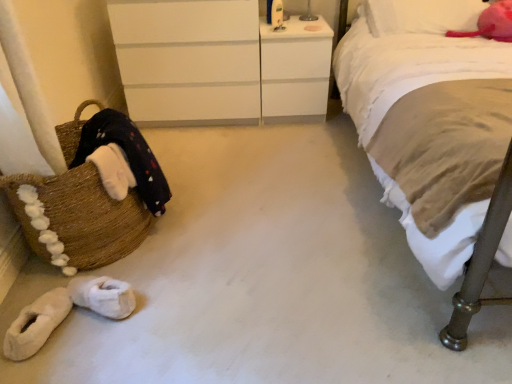
What do you see at coordinates (436, 136) in the screenshot?
I see `beige cotton bed at right` at bounding box center [436, 136].

This screenshot has width=512, height=384. Identify the location of white fluffy slippers at lower left, placed as the 2th footwear when sorted from left to right. (103, 296).

Which point is more forward, (x=462, y=204) or (x=146, y=39)?

Point (x=462, y=204)

Is beige cotton bed at right positioned with its back to white matte chest of drawers at upper center?

That's not correct — beige cotton bed at right is not looking away from white matte chest of drawers at upper center.

Can you tell me how much beige cotton bed at right and white matte chest of drawers at upper center differ in facing direction?

The angle between the facing direction of beige cotton bed at right and the facing direction of white matte chest of drawers at upper center is 1.53 degrees.

From the image's perspective, is beige cotton bed at right on top of white matte chest of drawers at upper center?

No, from the image's perspective, beige cotton bed at right is not on top of white matte chest of drawers at upper center.

Is velvety pink pillow at upper right directly adjacent to white matte chest of drawers at upper center?

velvety pink pillow at upper right and white matte chest of drawers at upper center are clearly separated.

Which of these two, velvety pink pillow at upper right or white matte chest of drawers at upper center, stands taller?

white matte chest of drawers at upper center.

How different are the orientations of velvety pink pillow at upper right and white matte chest of drawers at upper center in degrees?

There is a 2.8-degree angle between the facing directions of velvety pink pillow at upper right and white matte chest of drawers at upper center.

Between white glossy vanity at upper center and velvety pink pillow at upper right, which one is positioned in front?

velvety pink pillow at upper right is more forward.

From a real-world perspective, is white glossy vanity at upper center below velvety pink pillow at upper right?

Yes, from a real-world perspective, white glossy vanity at upper center is beneath velvety pink pillow at upper right.

Is white glossy vanity at upper center bigger than velvety pink pillow at upper right?

Yes.

This screenshot has width=512, height=384. I want to click on pillow in front of the white glossy vanity at upper center, so (x=421, y=16).

Which object is wider, velvety pink pillow at upper right or beige cotton bed at right?

beige cotton bed at right.

Considering the relative sizes of velvety pink pillow at upper right and beige cotton bed at right in the image provided, is velvety pink pillow at upper right bigger than beige cotton bed at right?

Actually, velvety pink pillow at upper right might be smaller than beige cotton bed at right.

From the image's perspective, is velvety pink pillow at upper right located above or below beige cotton bed at right?

From the image's perspective, velvety pink pillow at upper right appears above beige cotton bed at right.

From a real-world perspective, which object rests below the other?

beige cotton bed at right.

From a real-world perspective, which object rests below the other?

white matte chest of drawers at upper center, from a real-world perspective.

Consider the image. Does white matte chest of drawers at upper center turn towards beige cotton bed at right?

No, white matte chest of drawers at upper center is not aimed at beige cotton bed at right.

Is white matte chest of drawers at upper center not within beige cotton bed at right?

Yes.

Which object is positioned more to the right, white matte chest of drawers at upper center or beige cotton bed at right?

beige cotton bed at right is more to the right.

Considering the points (381, 88) and (302, 43), which point is in front, point (381, 88) or point (302, 43)?

The point (381, 88) is closer.

Is beige cotton bed at right positioned far away from white glossy vanity at upper center?

They are positioned close to each other.

Which object is further away from the camera taking this photo, beige cotton bed at right or white glossy vanity at upper center?

white glossy vanity at upper center is further from the camera.

From a real-world perspective, between beige cotton bed at right and white glossy vanity at upper center, who is vertically higher?

In real-world perspective, beige cotton bed at right is above.

Does velvety pink pillow at upper right have a greater height compared to brown woven basket at left?

In fact, velvety pink pillow at upper right may be shorter than brown woven basket at left.

In terms of width, does velvety pink pillow at upper right look wider or thinner when compared to brown woven basket at left?

Considering their sizes, velvety pink pillow at upper right looks broader than brown woven basket at left.

Is velvety pink pillow at upper right far from brown woven basket at left?

Yes, velvety pink pillow at upper right and brown woven basket at left are located far from each other.

Between point (365, 6) and point (64, 232), which one is positioned in front?

The point (64, 232) is closer to the camera.

Locate an element on the screen. This screenshot has height=384, width=512. bed located in front of the white matte chest of drawers at upper center is located at coordinates (436, 136).

I want to click on pillow that is above the white matte chest of drawers at upper center (from a real-world perspective), so click(421, 16).

Estimate the real-world distances between objects in this image. Which object is closer to white fluffy slippers at lower left, placed as the 2th footwear when sorted from left to right, brown woven basket at left or velvety pink pillow at upper right?

brown woven basket at left is closer to white fluffy slippers at lower left, placed as the 2th footwear when sorted from left to right.

When comparing their distances from white fluffy slippers at lower left, placed as the 2th footwear when sorted from left to right, does velvety pink pillow at upper right or beige cotton bed at right seem closer?

Based on the image, beige cotton bed at right appears to be nearer to white fluffy slippers at lower left, placed as the 2th footwear when sorted from left to right.

Based on their spatial positions, is beige cotton bed at right or brown woven basket at left further from white fluffy slippers at lower left, placed as the 2th footwear when sorted from left to right?

Based on the image, beige cotton bed at right appears to be further to white fluffy slippers at lower left, placed as the 2th footwear when sorted from left to right.

From the image, which object appears to be farther from white matte chest of drawers at upper center, brown woven basket at left or velvety pink pillow at upper right?

brown woven basket at left is further to white matte chest of drawers at upper center.

Which object lies further to the anchor point beige cotton bed at right, white fluffy slippers at lower left, the first footwear positioned from the right, or white fluffy slippers at lower left, which is the second footwear in right-to-left order?

white fluffy slippers at lower left, which is the second footwear in right-to-left order.

Considering their positions, is white fluffy slippers at lower left, the first footwear from the left, positioned closer to white matte chest of drawers at upper center than white glossy vanity at upper center?

white glossy vanity at upper center is positioned closer to the anchor white matte chest of drawers at upper center.

Looking at the image, which one is located closer to brown woven basket at left, beige cotton bed at right or white fluffy slippers at lower left, the first footwear positioned from the right?

white fluffy slippers at lower left, the first footwear positioned from the right, lies closer to brown woven basket at left than the other object.

Considering their positions, is white glossy vanity at upper center positioned further to velvety pink pillow at upper right than white fluffy slippers at lower left, the first footwear from the left?

white fluffy slippers at lower left, the first footwear from the left.

Locate an element on the screen. chest of drawers between brown woven basket at left and white glossy vanity at upper center in the front-back direction is located at coordinates (220, 63).

This screenshot has height=384, width=512. Identify the location of vanity between white fluffy slippers at lower left, the first footwear from the left, and velvety pink pillow at upper right. (295, 71).

Image resolution: width=512 pixels, height=384 pixels. In order to click on vanity that lies between white matte chest of drawers at upper center and white fluffy slippers at lower left, placed as the 2th footwear when sorted from left to right, from top to bottom in this screenshot , I will do `click(295, 71)`.

You are a GUI agent. You are given a task and a screenshot of the screen. Output one action in this format:
    pyautogui.click(x=<x>, y=<y>)
    Task: Click on the chest of drawers between brown woven basket at left and beige cotton bed at right in the horizontal direction
    
    Given the screenshot: What is the action you would take?
    pyautogui.click(x=220, y=63)